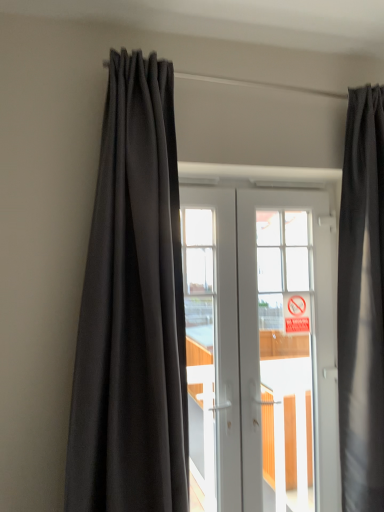
What do you see at coordinates (362, 304) in the screenshot? The width and height of the screenshot is (384, 512). I see `matte black curtain at upper right, which appears as the 1th curtain when viewed from the right` at bounding box center [362, 304].

Describe the element at coordinates (132, 309) in the screenshot. The image size is (384, 512). I see `dark gray fabric curtain at left, which is the 1th curtain from left to right` at that location.

The height and width of the screenshot is (512, 384). What do you see at coordinates (296, 313) in the screenshot?
I see `red plastic sign at center` at bounding box center [296, 313].

Measure the distance between white glossy door at center and camera.

white glossy door at center is 6.26 feet away from camera.

Where is `white glossy door at center`? Image resolution: width=384 pixels, height=512 pixels. white glossy door at center is located at coordinates (260, 347).

At what (x,y) coordinates should I click in order to perform the action: click on matte black curtain at upper right, acting as the 2th curtain starting from the left. Please return your answer as a coordinate pair (x, y). Looking at the image, I should click on (362, 304).

Is matte black curtain at upper right, acting as the 2th curtain starting from the left, positioned with its back to dark gray fabric curtain at left, which is the 1th curtain from left to right?

That's not correct — matte black curtain at upper right, acting as the 2th curtain starting from the left, is not looking away from dark gray fabric curtain at left, which is the 1th curtain from left to right.

Would you say dark gray fabric curtain at left, which is counted as the second curtain, starting from the right, is part of matte black curtain at upper right, which appears as the 1th curtain when viewed from the right,'s contents?

No, dark gray fabric curtain at left, which is counted as the second curtain, starting from the right, is not inside matte black curtain at upper right, which appears as the 1th curtain when viewed from the right.

Which point is more forward, (x=353, y=293) or (x=183, y=359)?

The point (x=183, y=359) is more forward.

Does point (134, 103) appear closer or farther from the camera than point (289, 295)?

Clearly, point (134, 103) is closer to the camera than point (289, 295).

Is dark gray fabric curtain at left, which is the 1th curtain from left to right, positioned with its back to red plastic sign at center?

No.

Considering the positions of objects dark gray fabric curtain at left, which is the 1th curtain from left to right, and red plastic sign at center in the image provided, who is more to the left, dark gray fabric curtain at left, which is the 1th curtain from left to right, or red plastic sign at center?

From the viewer's perspective, dark gray fabric curtain at left, which is the 1th curtain from left to right, appears more on the left side.

From a real-world perspective, which is physically above, white glossy door at center or matte black curtain at upper right, which appears as the 1th curtain when viewed from the right?

In real-world perspective, matte black curtain at upper right, which appears as the 1th curtain when viewed from the right, is above.

Can we say white glossy door at center lies outside matte black curtain at upper right, which appears as the 1th curtain when viewed from the right?

Yes, white glossy door at center is outside of matte black curtain at upper right, which appears as the 1th curtain when viewed from the right.

Is white glossy door at center oriented towards matte black curtain at upper right, which appears as the 1th curtain when viewed from the right?

Yes, white glossy door at center is aimed at matte black curtain at upper right, which appears as the 1th curtain when viewed from the right.

Is point (290, 228) in front of point (123, 494)?

No.

Consider the image. From their relative heights in the image, would you say white glossy door at center is taller or shorter than dark gray fabric curtain at left, which is counted as the second curtain, starting from the right?

white glossy door at center is shorter than dark gray fabric curtain at left, which is counted as the second curtain, starting from the right.

Is white glossy door at center not close to dark gray fabric curtain at left, which is the 1th curtain from left to right?

Actually, white glossy door at center and dark gray fabric curtain at left, which is the 1th curtain from left to right, are a little close together.

The height and width of the screenshot is (512, 384). What are the coordinates of `parking sign lying above the white glossy door at center (from the image's perspective)` in the screenshot? It's located at (296, 313).

Are red plastic sign at center and white glossy door at center beside each other?

There is a gap between red plastic sign at center and white glossy door at center.

From the image's perspective, between red plastic sign at center and white glossy door at center, which one is located above?

red plastic sign at center appears higher in the image.

Could white glossy door at center be considered to be inside red plastic sign at center?

That's incorrect, white glossy door at center is not inside red plastic sign at center.

Between matte black curtain at upper right, acting as the 2th curtain starting from the left, and white glossy door at center, which one has less height?

Standing shorter between the two is white glossy door at center.

Is matte black curtain at upper right, which appears as the 1th curtain when viewed from the right, facing away from white glossy door at center?

That's right, matte black curtain at upper right, which appears as the 1th curtain when viewed from the right, is facing away from white glossy door at center.

Is matte black curtain at upper right, acting as the 2th curtain starting from the left, to the right of white glossy door at center from the viewer's perspective?

Indeed, matte black curtain at upper right, acting as the 2th curtain starting from the left, is positioned on the right side of white glossy door at center.

From the image's perspective, between matte black curtain at upper right, acting as the 2th curtain starting from the left, and white glossy door at center, which one is located above?

matte black curtain at upper right, acting as the 2th curtain starting from the left.

Which object is wider, matte black curtain at upper right, which appears as the 1th curtain when viewed from the right, or red plastic sign at center?

matte black curtain at upper right, which appears as the 1th curtain when viewed from the right, is wider.

From the image's perspective, does matte black curtain at upper right, acting as the 2th curtain starting from the left, appear lower than red plastic sign at center?

Incorrect, from the image's perspective, matte black curtain at upper right, acting as the 2th curtain starting from the left, is higher than red plastic sign at center.

Which object is positioned more to the right, matte black curtain at upper right, which appears as the 1th curtain when viewed from the right, or red plastic sign at center?

matte black curtain at upper right, which appears as the 1th curtain when viewed from the right, is more to the right.

Image resolution: width=384 pixels, height=512 pixels. What are the coordinates of `curtain located in front of the matte black curtain at upper right, which appears as the 1th curtain when viewed from the right` in the screenshot? It's located at (132, 309).

Locate an element on the screen. parking sign that is behind the dark gray fabric curtain at left, which is counted as the second curtain, starting from the right is located at coordinates (296, 313).

Looking at the image, which one is located further to dark gray fabric curtain at left, which is counted as the second curtain, starting from the right, white glossy door at center or matte black curtain at upper right, acting as the 2th curtain starting from the left?

matte black curtain at upper right, acting as the 2th curtain starting from the left.

From the image, which object appears to be nearer to matte black curtain at upper right, which appears as the 1th curtain when viewed from the right, white glossy door at center or dark gray fabric curtain at left, which is the 1th curtain from left to right?

The object closer to matte black curtain at upper right, which appears as the 1th curtain when viewed from the right, is white glossy door at center.

From the image, which object appears to be farther from dark gray fabric curtain at left, which is counted as the second curtain, starting from the right, white glossy door at center or red plastic sign at center?

Based on the image, red plastic sign at center appears to be further to dark gray fabric curtain at left, which is counted as the second curtain, starting from the right.

Looking at this image, based on their spatial positions, is red plastic sign at center or matte black curtain at upper right, which appears as the 1th curtain when viewed from the right, closer to dark gray fabric curtain at left, which is counted as the second curtain, starting from the right?

red plastic sign at center lies closer to dark gray fabric curtain at left, which is counted as the second curtain, starting from the right, than the other object.

Based on the photo, looking at the image, which one is located further to dark gray fabric curtain at left, which is counted as the second curtain, starting from the right, matte black curtain at upper right, which appears as the 1th curtain when viewed from the right, or white glossy door at center?

matte black curtain at upper right, which appears as the 1th curtain when viewed from the right, is further to dark gray fabric curtain at left, which is counted as the second curtain, starting from the right.

Which object lies nearer to the anchor point red plastic sign at center, dark gray fabric curtain at left, which is counted as the second curtain, starting from the right, or matte black curtain at upper right, which appears as the 1th curtain when viewed from the right?

The object closer to red plastic sign at center is matte black curtain at upper right, which appears as the 1th curtain when viewed from the right.

Based on the photo, when comparing their distances from red plastic sign at center, does white glossy door at center or matte black curtain at upper right, which appears as the 1th curtain when viewed from the right, seem closer?

white glossy door at center is positioned closer to the anchor red plastic sign at center.

Looking at the image, which one is located closer to white glossy door at center, dark gray fabric curtain at left, which is counted as the second curtain, starting from the right, or red plastic sign at center?

red plastic sign at center lies closer to white glossy door at center than the other object.

Where is `door located between dark gray fabric curtain at left, which is counted as the second curtain, starting from the right, and matte black curtain at upper right, which appears as the 1th curtain when viewed from the right, in the left-right direction`? Image resolution: width=384 pixels, height=512 pixels. door located between dark gray fabric curtain at left, which is counted as the second curtain, starting from the right, and matte black curtain at upper right, which appears as the 1th curtain when viewed from the right, in the left-right direction is located at coordinates (260, 347).

This screenshot has height=512, width=384. What are the coordinates of `door positioned between dark gray fabric curtain at left, which is the 1th curtain from left to right, and red plastic sign at center from near to far` in the screenshot? It's located at (260, 347).

In order to click on parking sign between dark gray fabric curtain at left, which is counted as the second curtain, starting from the right, and matte black curtain at upper right, acting as the 2th curtain starting from the left in this screenshot , I will do `click(296, 313)`.

I want to click on parking sign located between white glossy door at center and matte black curtain at upper right, which appears as the 1th curtain when viewed from the right, in the left-right direction, so click(x=296, y=313).